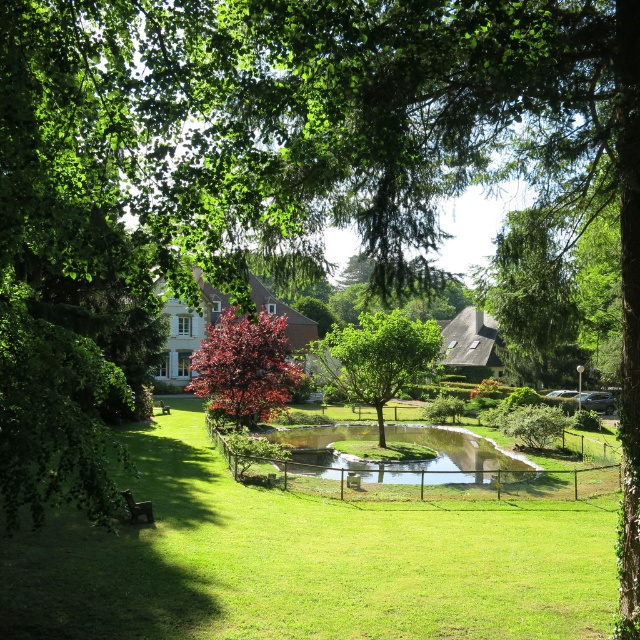
You are standing in the garden and want to take a photo of the shiny red tree at center. Which direction should you face to ensure the tree is in the center of your camera view?

The shiny red tree at center is located at point [244,365], so you should face directly towards the center of the garden to capture it in the camera view.

You are standing in the garden and want to locate the green grassy pond at center. According to the coordinates provided, where exactly is it positioned?

The green grassy pond at center is located at coordinates point (408, 460).

From the picture: You are a gardener standing at the edge of the garden. You need to water the shiny red tree at center and the brown wooden park bench at lower left. Since the water hose is only long enough to reach one of them, which one should you prioritize watering first based on their positions?

The shiny red tree at center is located above the brown wooden park bench at lower left, so you should prioritize watering the shiny red tree at center first because it is higher and might require immediate attention before the water pressure decreases.